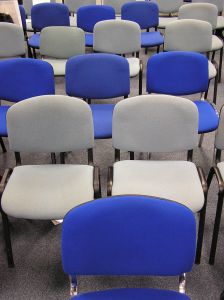
At what (x,y) coordinates should I click in order to perform the action: click on chairs in third row. Please return your answer as a coordinate pair (x, y). The width and height of the screenshot is (224, 300). Looking at the image, I should click on (29, 71), (100, 67), (165, 68).